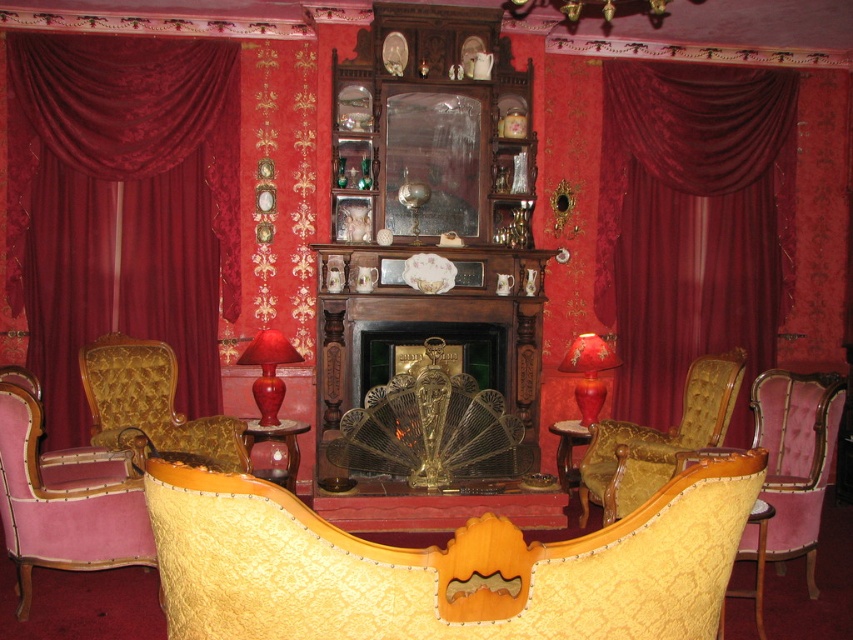
Who is more forward, (x=216, y=232) or (x=801, y=445)?

Point (x=801, y=445)

Which of these two, velvet drapery at left or velvet pink armchair at center, stands taller?

velvet drapery at left is taller.

Which is in front, point (138, 243) or point (772, 452)?

Point (772, 452) is more forward.

The image size is (853, 640). I want to click on velvet drapery at left, so click(x=122, y=205).

Is velvet pink armchair at center above matte glass vase at center?

No.

Identify the location of velvet pink armchair at center. This screenshot has width=853, height=640. (793, 461).

The height and width of the screenshot is (640, 853). I want to click on velvet pink armchair at center, so (x=793, y=461).

Which is behind, point (97, 524) or point (578, 429)?

The point (578, 429) is behind.

Based on the photo, who is positioned more to the right, velvet pink armchair at left or gold textured sofa at center?

gold textured sofa at center

Which is behind, point (96, 552) or point (570, 483)?

The point (570, 483) is behind.

The height and width of the screenshot is (640, 853). In order to click on velvet pink armchair at left in this screenshot , I will do `click(62, 497)`.